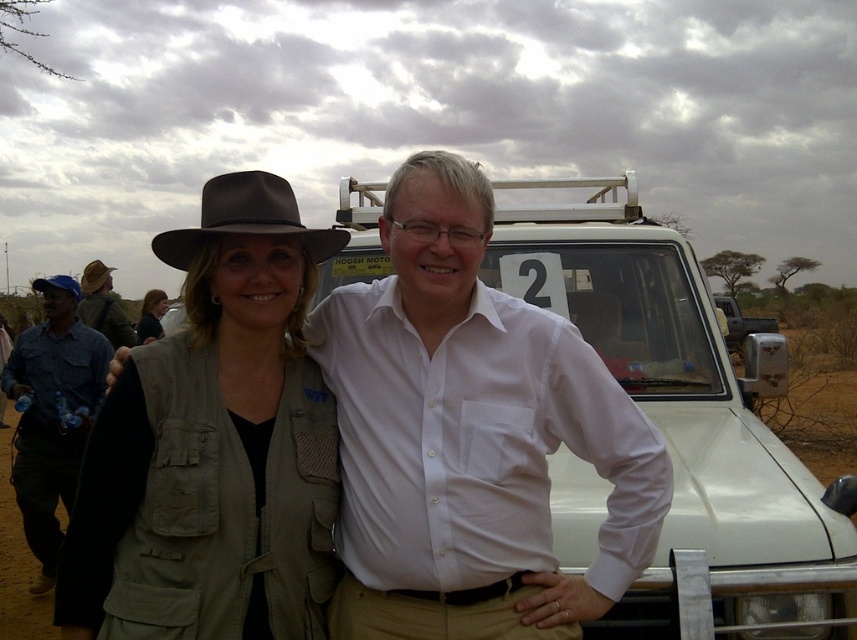
Can you confirm if brushed metal water bottle at left is bigger than khaki fabric jacket at center?

No, brushed metal water bottle at left is not bigger than khaki fabric jacket at center.

Does point (46, 444) come farther from viewer compared to point (157, 332)?

No, (46, 444) is in front of (157, 332).

Describe the element at coordinates (52, 419) in the screenshot. I see `brushed metal water bottle at left` at that location.

Identify the location of brushed metal water bottle at left. (52, 419).

Can you confirm if brushed metal water bottle at left is positioned to the right of brown felt fedora at left?

Correct, you'll find brushed metal water bottle at left to the right of brown felt fedora at left.

Is brushed metal water bottle at left positioned before brown felt fedora at left?

Yes, it is in front of brown felt fedora at left.

Locate an element on the screen. brushed metal water bottle at left is located at coordinates (52, 419).

Locate an element on the screen. brushed metal water bottle at left is located at coordinates (52, 419).

Does brushed metal water bottle at left appear on the left side of brown leather hat at upper left?

Incorrect, brushed metal water bottle at left is not on the left side of brown leather hat at upper left.

Between point (49, 588) and point (105, 289), which one is positioned in front?

Point (49, 588) is in front.

This screenshot has width=857, height=640. What do you see at coordinates (52, 419) in the screenshot?
I see `brushed metal water bottle at left` at bounding box center [52, 419].

Identify the location of brushed metal water bottle at left. (52, 419).